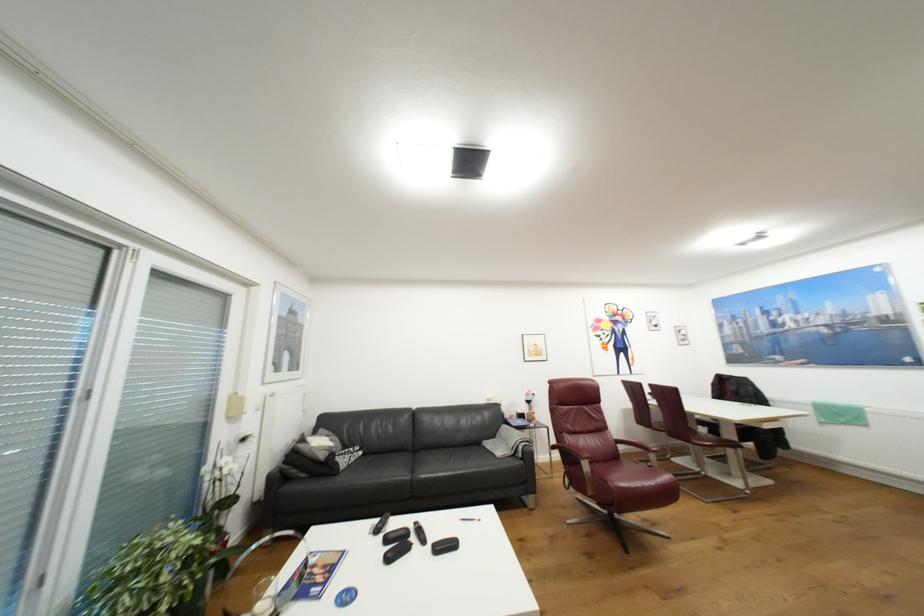
Describe the element at coordinates (430, 464) in the screenshot. I see `the black sofa sitting surface` at that location.